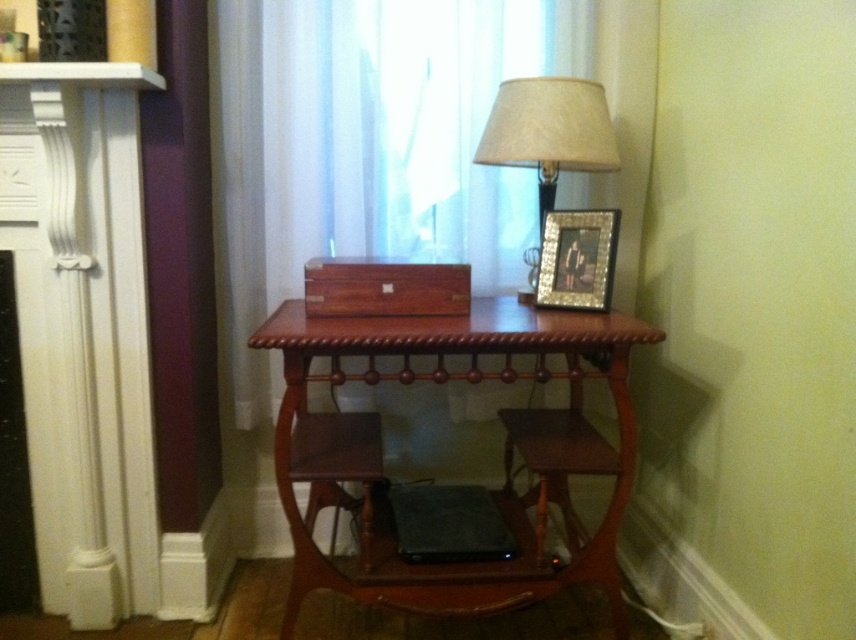
Question: Does wooden stool at lower right appear over gold textured picture frame at upper right?

Choices:
 (A) yes
 (B) no

Answer: (B)

Question: Which is farther from the translucent fabric curtain at upper center?

Choices:
 (A) wooden stool at lower right
 (B) matte beige fabric lampshade at upper right
 (C) gold textured picture frame at upper right

Answer: (A)

Question: Is translucent fabric curtain at upper center to the left of wooden stool at lower right from the viewer's perspective?

Choices:
 (A) yes
 (B) no

Answer: (A)

Question: Which point appears closest to the camera in this image?

Choices:
 (A) (560, 284)
 (B) (314, 51)
 (C) (569, 352)

Answer: (C)

Question: Does translucent fabric curtain at upper center have a larger size compared to gold textured picture frame at upper right?

Choices:
 (A) no
 (B) yes

Answer: (B)

Question: Among these objects, which one is nearest to the camera?

Choices:
 (A) matte beige fabric lampshade at upper right
 (B) mahogany wood table at center
 (C) wooden stool at lower right

Answer: (B)